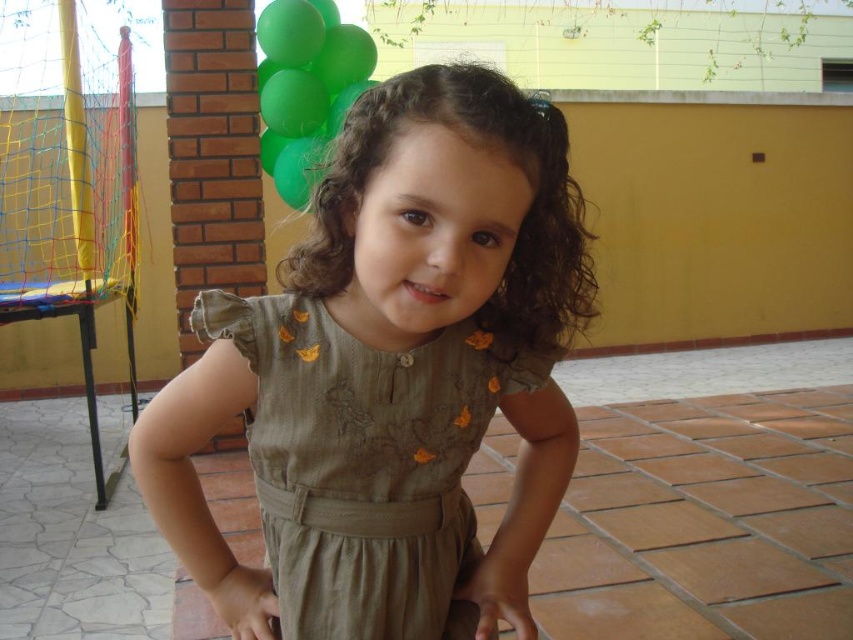
You are a photographer standing at a certain distance from the child. You want to ensure that the matte green dress at center is clearly visible in your photo. Given that the dress is 54.94 centimeters away from the viewer, what is the minimum distance you should maintain to keep it in focus?

The matte green dress at center is 54.94 centimeters away from the viewer. To ensure it stays in focus, the photographer should maintain a distance of at least 54.94 centimeters or closer.

You are a photographer setting up for a family portrait. You have a dress that is olive green fabric dress at center and a green matte balloon at upper left. Which object is wider?

The olive green fabric dress at center is narrower than the green matte balloon at upper left, so the green matte balloon at upper left is wider.

In the scene shown: You are a photographer trying to capture the child in the center of the image. The child is wearing a dress represented by the point at (397, 353). Where should you position your camera to ensure the dress is centered in the photo?

The point representing the matte green dress at center is located at coordinates (397, 353). To center the dress in the photo, position the camera so that this point aligns with the center of the frame.